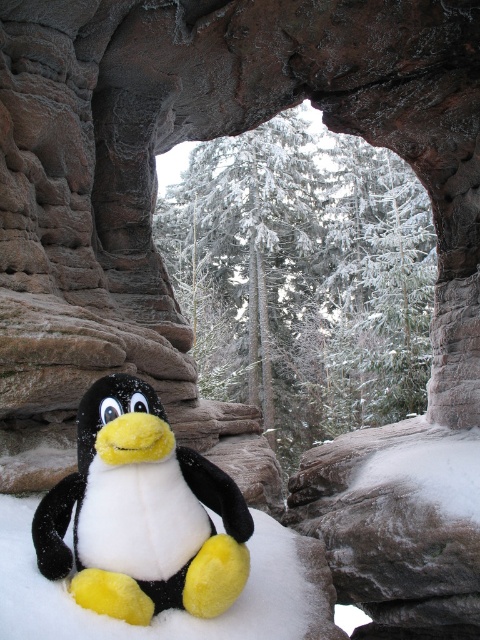
Question: Which point is farther to the camera?

Choices:
 (A) (25, 524)
 (B) (139, 513)

Answer: (A)

Question: Among these points, which one is farthest from the camera?

Choices:
 (A) (139, 428)
 (B) (262, 620)

Answer: (B)

Question: Is the position of black plush penguin at center less distant than that of white fluffy snow at center?

Choices:
 (A) yes
 (B) no

Answer: (B)

Question: Is black plush penguin at center wider than white fluffy snow at center?

Choices:
 (A) yes
 (B) no

Answer: (B)

Question: Does black plush penguin at center appear over white fluffy snow at center?

Choices:
 (A) no
 (B) yes

Answer: (B)